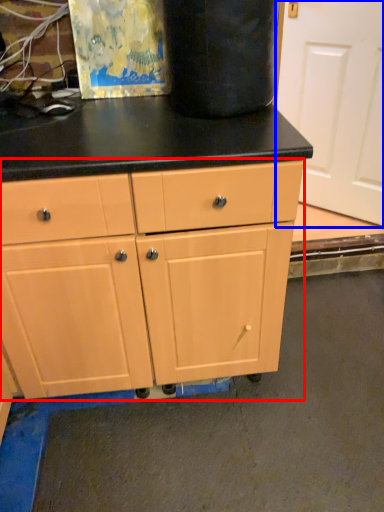
Question: Which of the following is the farthest to the observer, chest of drawers (highlighted by a red box) or screen door (highlighted by a blue box)?

Choices:
 (A) chest of drawers
 (B) screen door

Answer: (B)